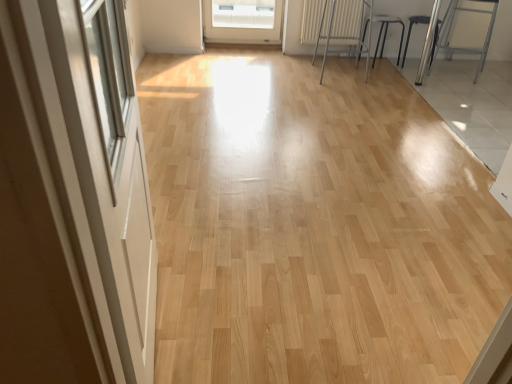
Locate an element on the screen. This screenshot has height=384, width=512. free point below white textured radiator at upper center (from a real-world perspective) is located at coordinates (329, 57).